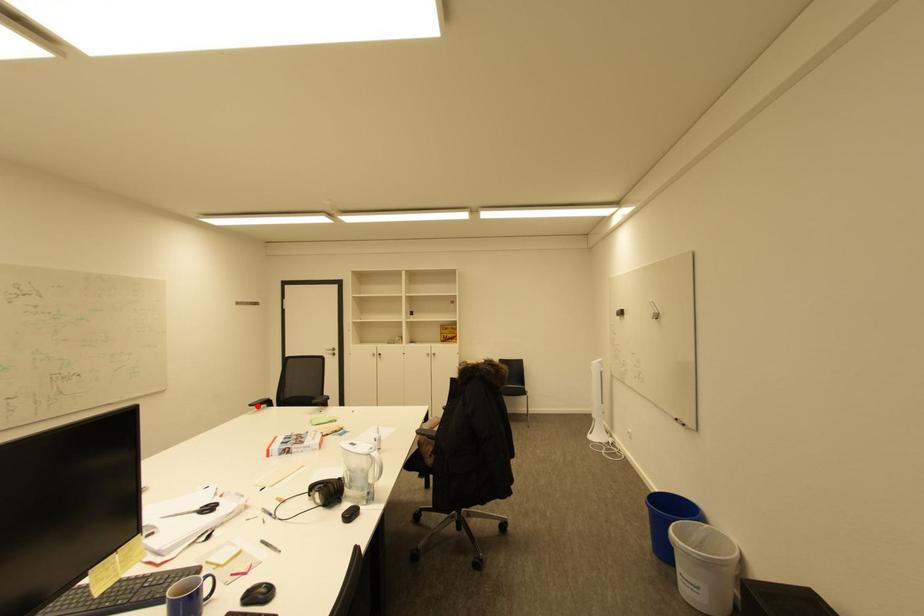
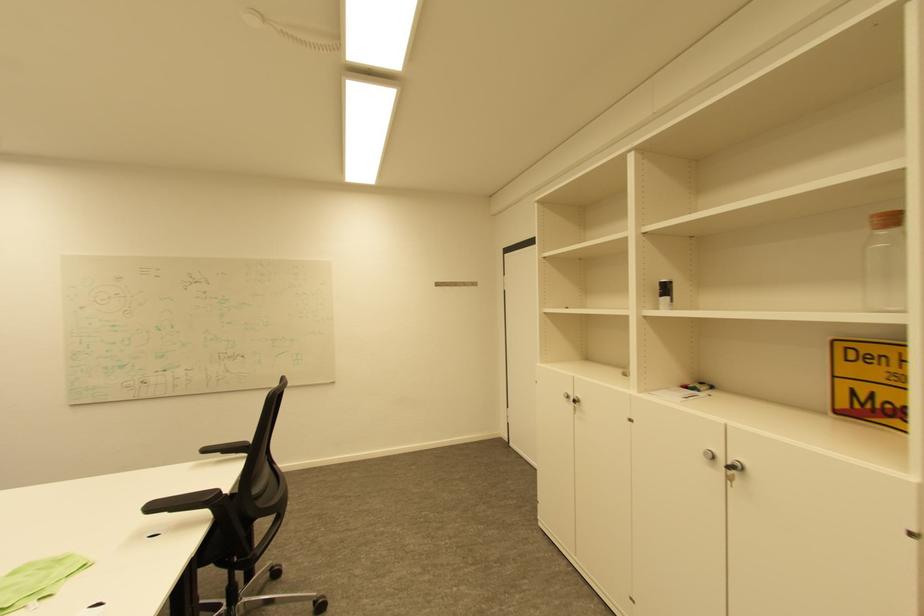
Find the pixel in the second image that matches the highlighted location in the first image.

(213, 450)